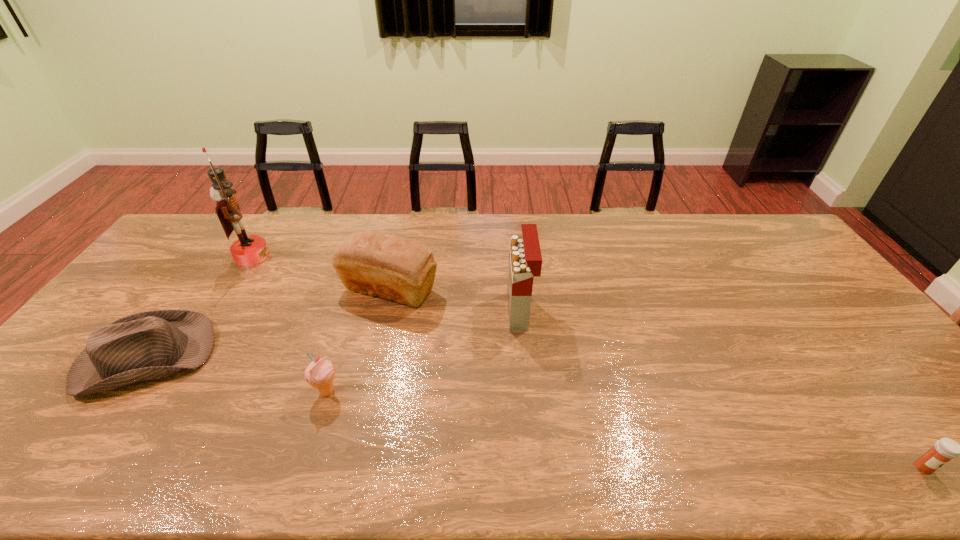
Where is `vacant point located between the second object from right to left and the fedora`? This screenshot has height=540, width=960. vacant point located between the second object from right to left and the fedora is located at coordinates tap(333, 335).

The height and width of the screenshot is (540, 960). In order to click on free space between the icecream and the tallest object in this screenshot , I will do `click(290, 323)`.

Identify the location of unoccupied position between the fedora and the cigarette case. (333, 335).

At what (x,y) coordinates should I click in order to perform the action: click on vacant area that lies between the cigarette case and the bread. Please return your answer as a coordinate pair (x, y). Looking at the image, I should click on (455, 300).

I want to click on vacant space in between the bread and the fedora, so click(x=268, y=324).

Locate which object ranks second in proximity to the fedora. Please provide its 2D coordinates. Your answer should be formatted as a tuple, i.e. [(x, y)], where the tuple contains the x and y coordinates of a point satisfying the conditions above.

[(392, 267)]

The image size is (960, 540). Identify the location of object that ranks as the closest to the bread. (525, 260).

You are a GUI agent. You are given a task and a screenshot of the screen. Output one action in this format:
    pyautogui.click(x=<x>, y=<y>)
    Task: Click on the free location that satisfies the following two spatial constraints: 1. on the front side of the icecream; 2. on the left side of the fedora
    The image size is (960, 540).
    Given the screenshot: What is the action you would take?
    pyautogui.click(x=122, y=392)

Where is `vacant space that satisfies the following two spatial constraints: 1. on the front-facing side of the farthest object; 2. on the right side of the bread`? The image size is (960, 540). vacant space that satisfies the following two spatial constraints: 1. on the front-facing side of the farthest object; 2. on the right side of the bread is located at coordinates (231, 289).